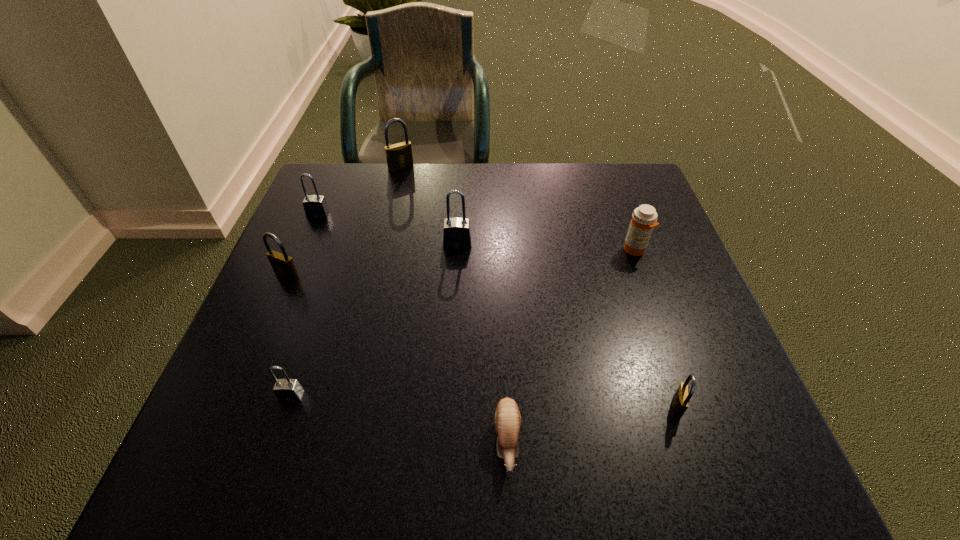
At what (x,y) coordinates should I click in order to perform the action: click on the biggest brass padlock. Please return your answer as a coordinate pair (x, y). This screenshot has height=540, width=960. Looking at the image, I should click on (399, 157).

Locate an element on the screen. This screenshot has width=960, height=540. the farthest padlock is located at coordinates (399, 157).

At what (x,y) coordinates should I click in order to perform the action: click on the biggest gray padlock. Please return your answer as a coordinate pair (x, y). The image size is (960, 540). Looking at the image, I should click on (457, 232).

Find the location of a particular element. The height and width of the screenshot is (540, 960). the second padlock from right to left is located at coordinates (457, 232).

Locate an element on the screen. the second farthest padlock is located at coordinates (315, 206).

I want to click on the second biggest gray padlock, so click(315, 206).

I want to click on the second nearest brass padlock, so click(283, 265).

Where is `the third nearest padlock`? The height and width of the screenshot is (540, 960). the third nearest padlock is located at coordinates (283, 265).

Locate an element on the screen. Image resolution: width=960 pixels, height=540 pixels. medicine is located at coordinates (644, 218).

What are the coordinates of `the third padlock from left to right` in the screenshot? It's located at (288, 390).